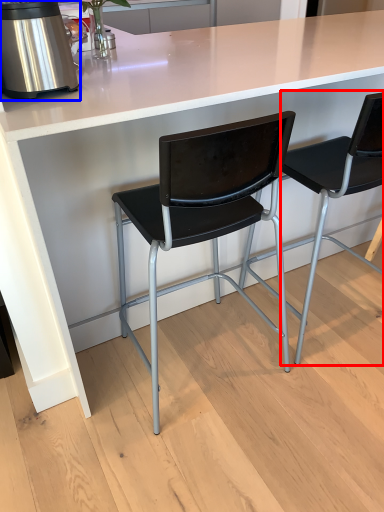
Question: Among these objects, which one is nearest to the camera, chair (highlighted by a red box) or kitchen appliance (highlighted by a blue box)?

Choices:
 (A) chair
 (B) kitchen appliance

Answer: (B)